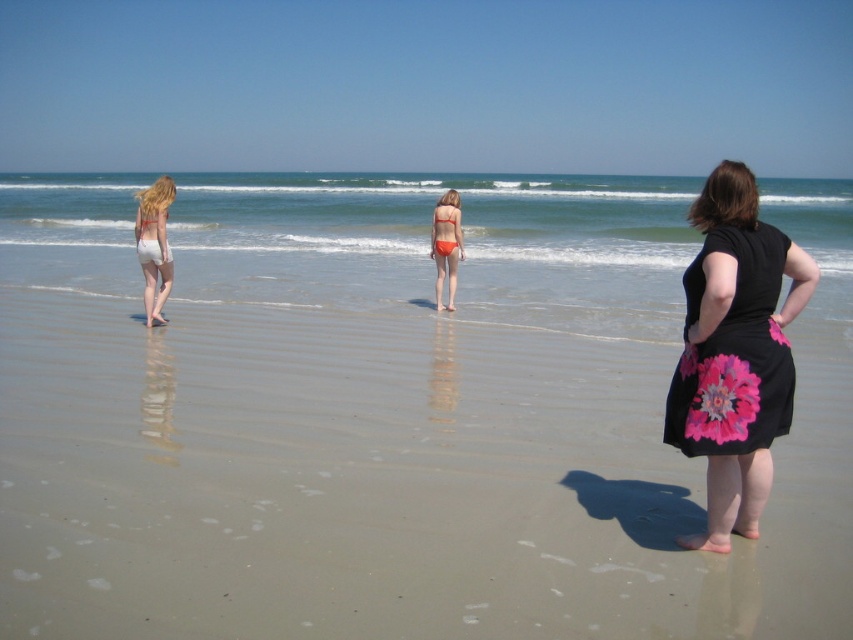
You are planning to take a photo of the black floral dress at right and the orange matte bikini at center. If you want to ensure both are visible in the frame, which object should you position closer to the camera to avoid cropping?

The black floral dress at right is wider than the orange matte bikini at center. To ensure both are visible, position the black floral dress at right closer to the camera since wider objects need to be nearer to maintain visibility without cropping.

You are a photographer trying to capture a photo of the sandy beach at center and the orange matte bikini at center. Based on their heights, which object will appear larger in the photo?

The sandy beach at center will appear larger in the photo because it has a greater height compared to the orange matte bikini at center.

You are a photographer planning to take a photo of the beach scene. You want to ensure that both the black floral dress at right and the orange matte bikini at center are clearly visible. Given their sizes, which object should you focus on to ensure both are in focus?

The black floral dress at right is taller than the orange matte bikini at center, so focusing on the black floral dress at right will help ensure both are in focus since it is larger and requires more attention.